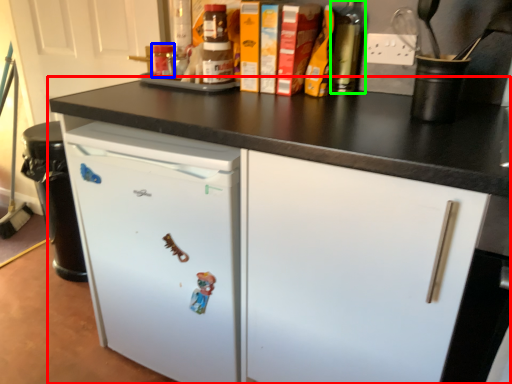
Question: Which is nearer to the cabinetry (highlighted by a red box)? bottle (highlighted by a blue box) or bottle (highlighted by a green box).

Choices:
 (A) bottle
 (B) bottle

Answer: (B)